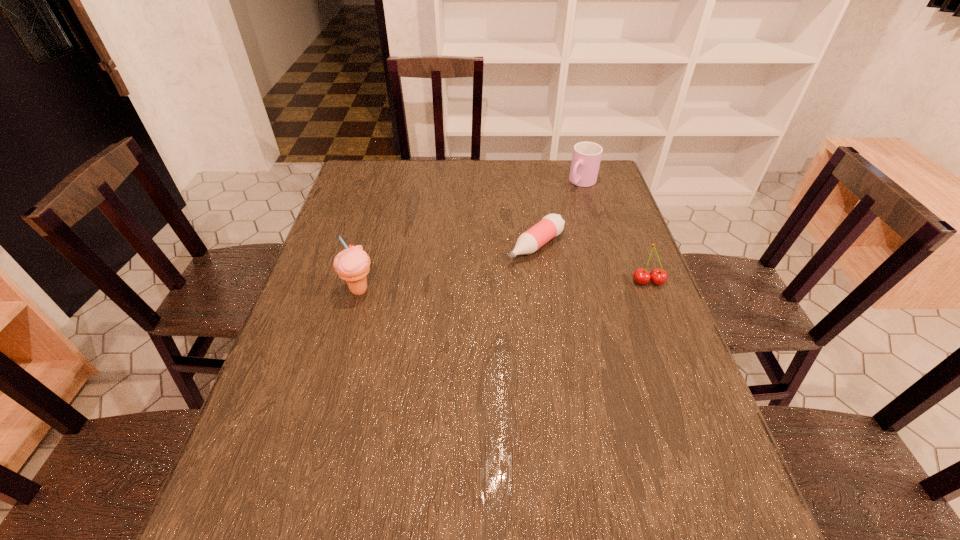
The width and height of the screenshot is (960, 540). Find the location of `vacant space on the desktop that is between the icecream and the rightmost object and is positioned with the handle on the side of the farthest object`. vacant space on the desktop that is between the icecream and the rightmost object and is positioned with the handle on the side of the farthest object is located at coordinates (475, 287).

You are a GUI agent. You are given a task and a screenshot of the screen. Output one action in this format:
    pyautogui.click(x=<x>, y=<y>)
    Task: Click on the vacant spot on the desktop that is between the leftmost object and the rightmost object and is positioned with the cap open on the second object from left to right
    This screenshot has width=960, height=540.
    Given the screenshot: What is the action you would take?
    coord(482,287)